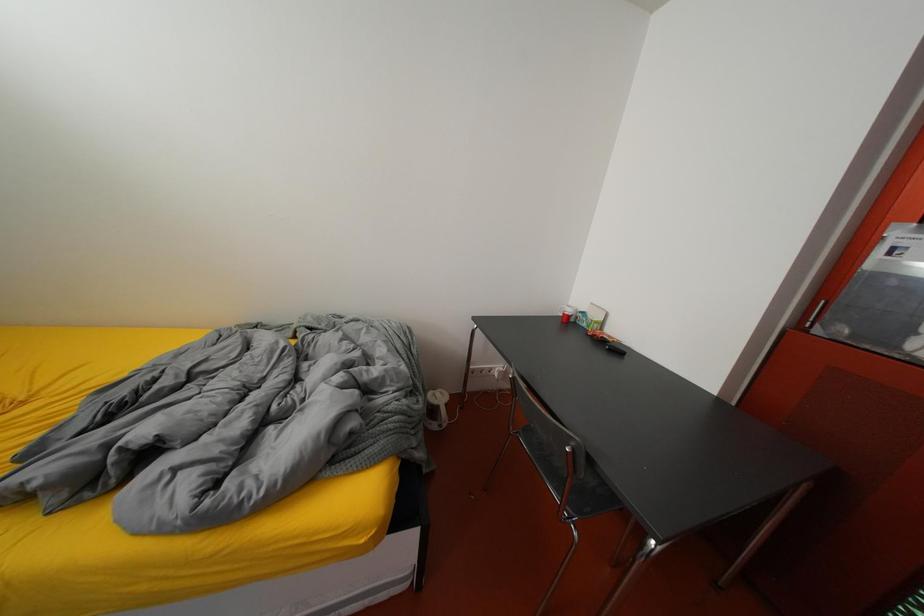
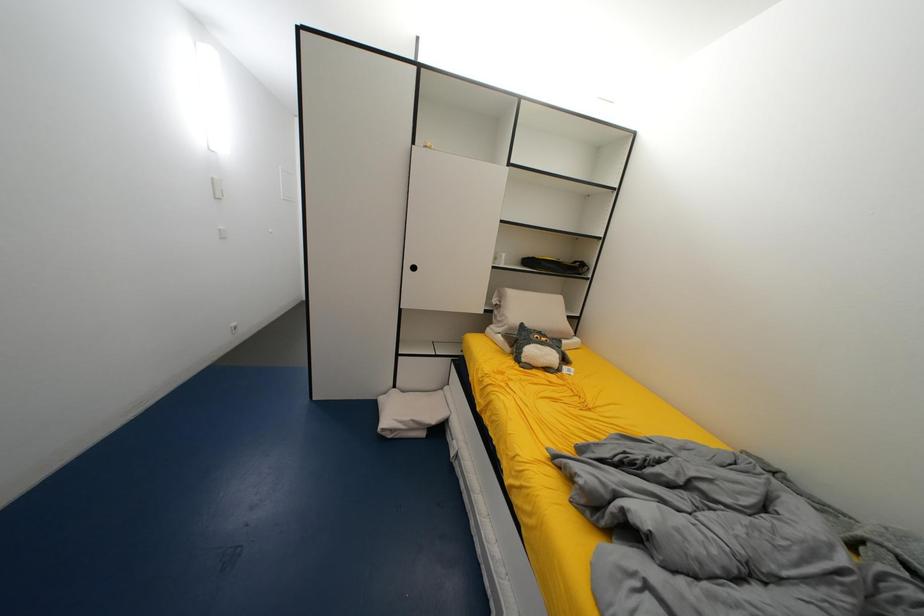
Question: The camera is either moving clockwise (left) or counter-clockwise (right) around the object. The first image is from the beginning of the video and the second image is from the end. Is the camera moving left or right when shooting the video?

Choices:
 (A) Left
 (B) Right

Answer: (B)